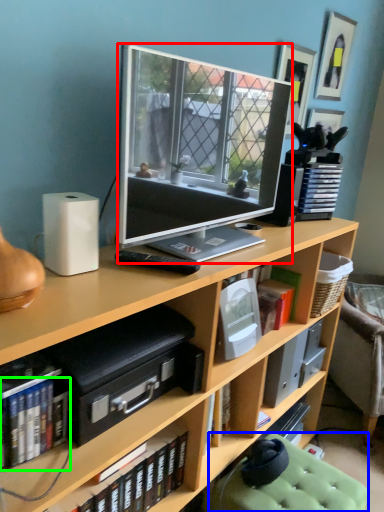
Question: Considering the real-world distances, which object is closest to television (highlighted by a red box)? swivel chair (highlighted by a blue box) or book (highlighted by a green box).

Choices:
 (A) swivel chair
 (B) book

Answer: (B)